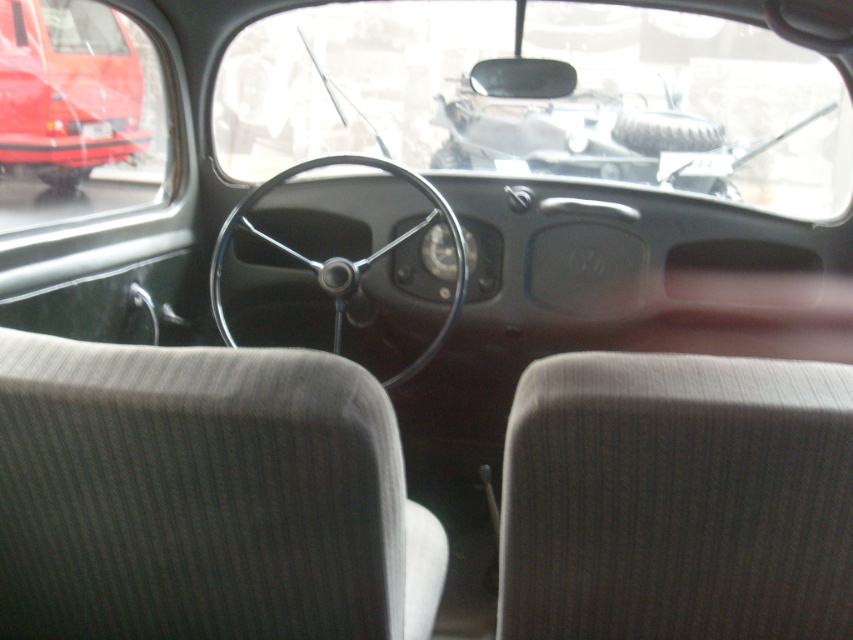
Question: Estimate the real-world distances between objects in this image. Which object is closer to the metallic gray engine at center?

Choices:
 (A) matte red car at left
 (B) black metallic steering wheel at center

Answer: (B)

Question: Can you confirm if matte red car at left is positioned below black metallic steering wheel at center?

Choices:
 (A) no
 (B) yes

Answer: (A)

Question: Which object is farther from the camera taking this photo?

Choices:
 (A) metallic gray engine at center
 (B) matte red car at left

Answer: (B)

Question: Where is metallic gray engine at center located in relation to black metallic steering wheel at center in the image?

Choices:
 (A) below
 (B) above

Answer: (B)

Question: Does metallic gray engine at center appear on the right side of matte red car at left?

Choices:
 (A) no
 (B) yes

Answer: (B)

Question: Which of the following is the farthest from the observer?

Choices:
 (A) matte red car at left
 (B) black metallic steering wheel at center

Answer: (A)